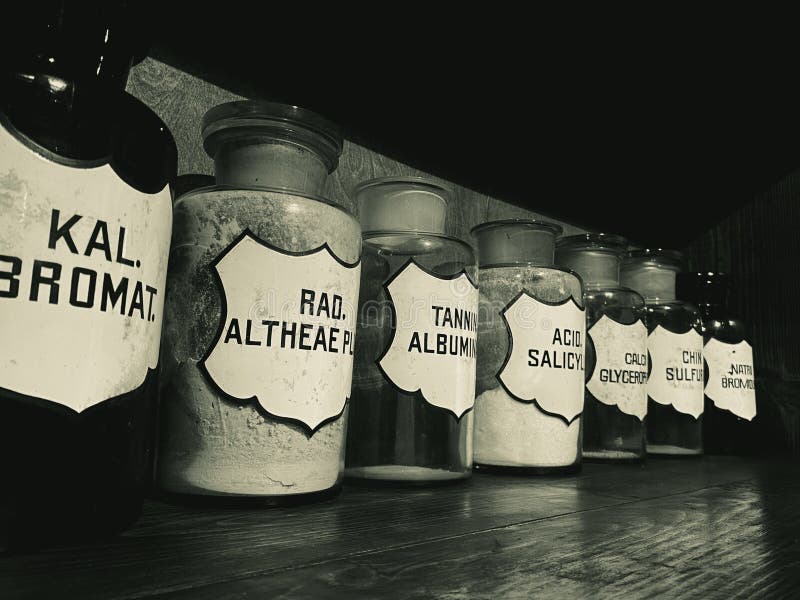
At what (x,y) coordinates should I click in order to perform the action: click on black jar. Please return your answer as a coordinate pair (x, y). Looking at the image, I should click on (102, 442), (730, 425).